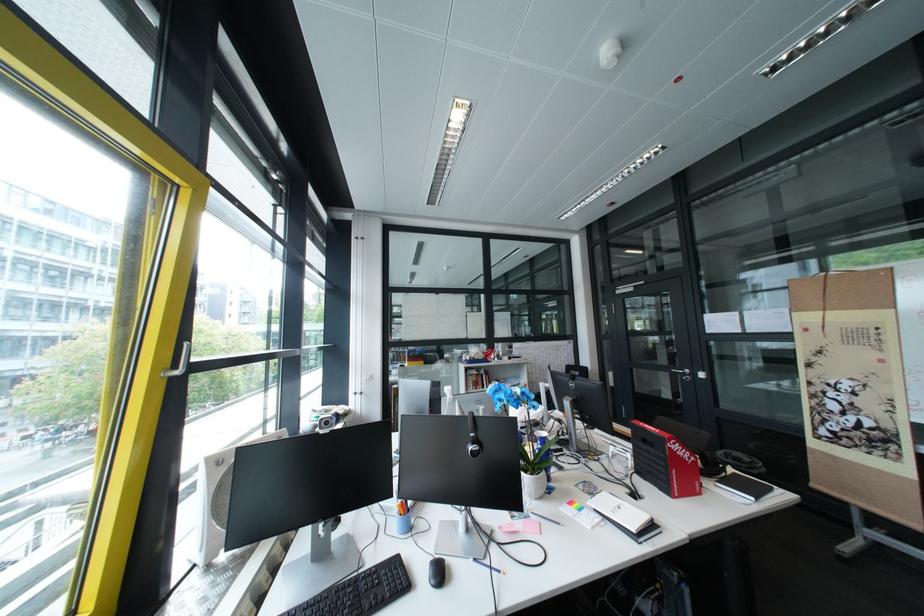
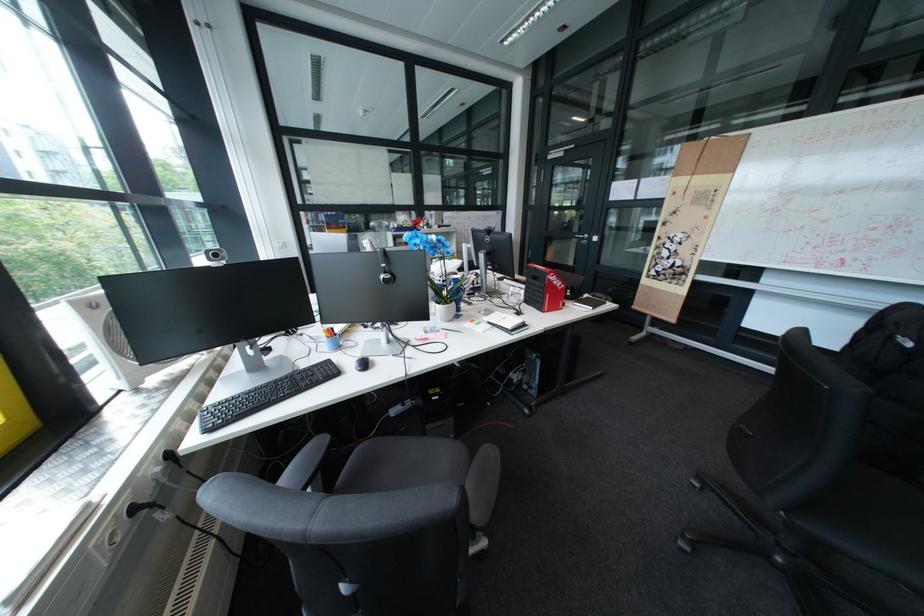
Question: The images are taken continuously from a first-person perspective. In which direction is your viewpoint rotating?

Choices:
 (A) Left
 (B) Right
 (C) Up
 (D) Down

Answer: (D)